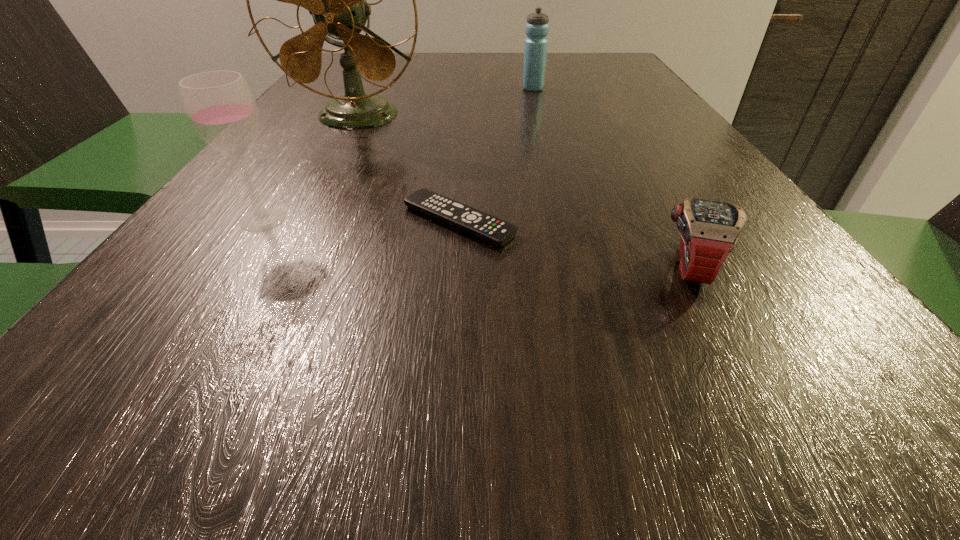
Where is `blank space at the near left corner of the desktop`? The width and height of the screenshot is (960, 540). blank space at the near left corner of the desktop is located at coordinates (116, 450).

Find the location of `vacant space at the far right corner`. vacant space at the far right corner is located at coordinates (576, 69).

The height and width of the screenshot is (540, 960). I want to click on vacant space that's between the remote control and the watch, so click(x=573, y=245).

I want to click on vacant space that's between the second object from right to left and the fourth tallest object, so click(611, 178).

The height and width of the screenshot is (540, 960). I want to click on free spot between the rightmost object and the fourth object from left to right, so click(x=611, y=178).

In order to click on free spot between the shortest object and the wineglass in this screenshot , I will do `click(361, 220)`.

This screenshot has height=540, width=960. Find the location of `free space that is in between the fourth object from left to right and the tallest object`. free space that is in between the fourth object from left to right and the tallest object is located at coordinates (445, 102).

The height and width of the screenshot is (540, 960). I want to click on vacant point located between the tallest object and the shortest object, so coord(408,168).

Locate an element on the screen. The image size is (960, 540). empty space that is in between the watch and the shortest object is located at coordinates (573, 245).

Where is `vacant space that is in between the wineglass and the water bottle`? Image resolution: width=960 pixels, height=540 pixels. vacant space that is in between the wineglass and the water bottle is located at coordinates (397, 154).